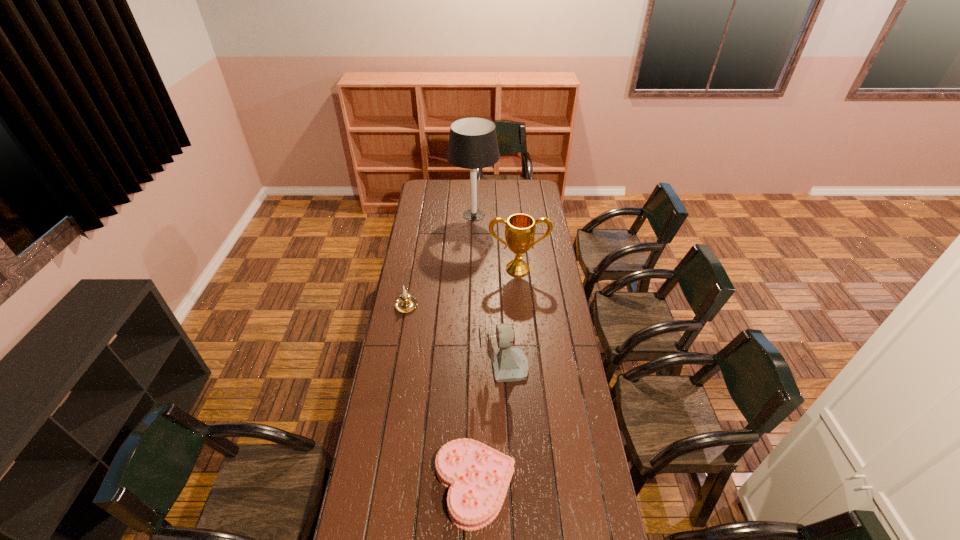
The width and height of the screenshot is (960, 540). Find the location of `blank space located in front of the fan to blow air`. blank space located in front of the fan to blow air is located at coordinates (449, 368).

Locate an element on the screen. vacant space located 0.210m in front of the fan to blow air is located at coordinates (428, 368).

Locate an element on the screen. Image resolution: width=960 pixels, height=540 pixels. vacant space located 0.320m on the front-facing side of the fourth nearest object is located at coordinates (523, 326).

Find the location of `free space located on the handle side of the third nearest object`. free space located on the handle side of the third nearest object is located at coordinates (412, 275).

What are the coordinates of `vacant space located on the handle side of the third nearest object` in the screenshot? It's located at (410, 285).

The width and height of the screenshot is (960, 540). Identify the location of vacant space located 0.160m on the handle side of the third nearest object. (412, 272).

Locate an element on the screen. free spot located on the back of the nearest object is located at coordinates (476, 391).

What are the coordinates of `object at the left edge` in the screenshot? It's located at (406, 302).

I want to click on object present at the right edge, so click(x=520, y=228).

The image size is (960, 540). In the image, there is a desktop. What are the coordinates of `vacant region at the far edge` in the screenshot? It's located at (450, 184).